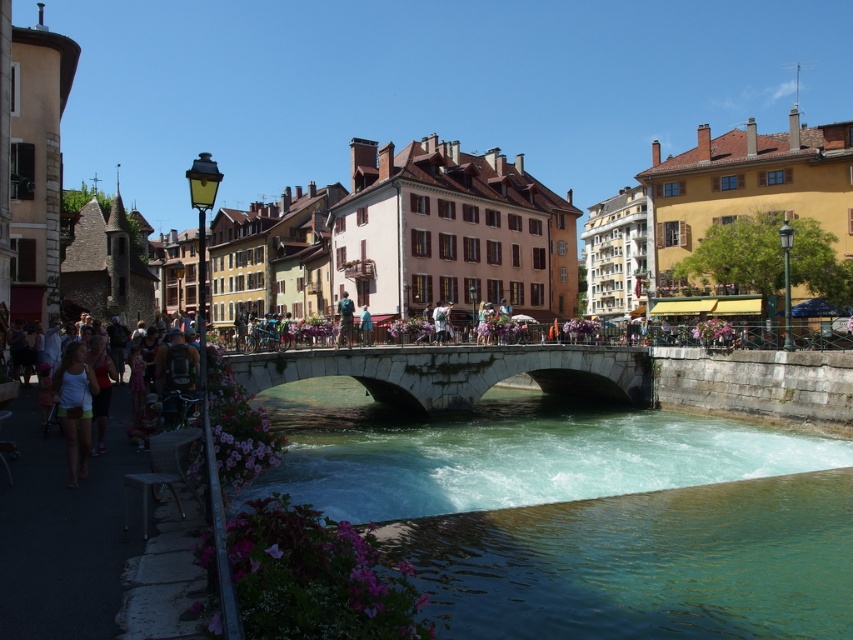
You are a photographer setting up a tripod to capture the stone bridge and the river. You notice two items in the foreground that could potentially block your shot. The white fabric shorts at lower left and the blue denim jeans at center. Which item is wider and might require you to adjust your camera angle more to avoid blocking the view of the bridge?

The white fabric shorts at lower left might be wider than the blue denim jeans at center, so adjusting the camera angle to account for its width would be necessary to avoid blocking the view of the stone bridge.